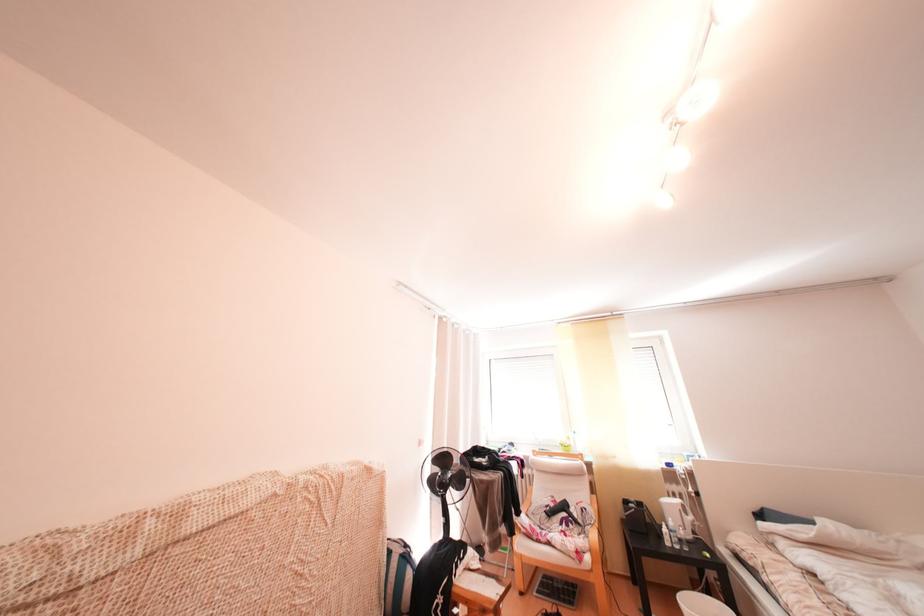
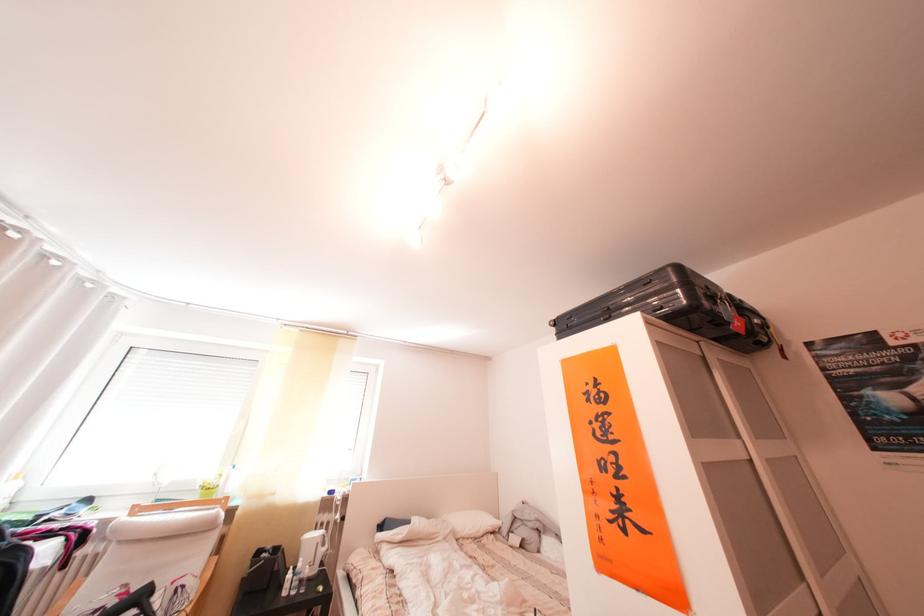
In the second image, find the point that corresponds to pixel 684 529 in the first image.

(312, 570)